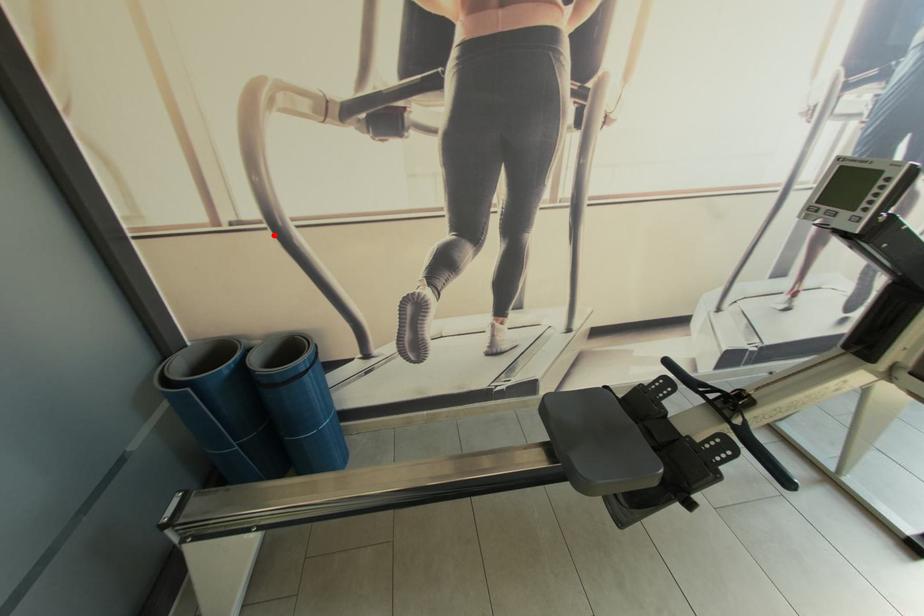
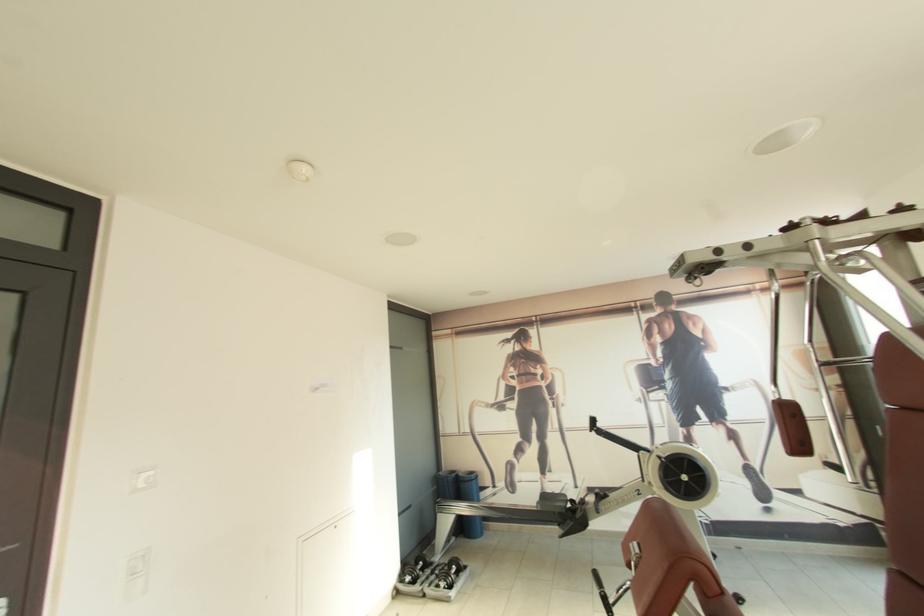
Where in the second image is the point corresponding to the highlighted location from the first image?

(476, 438)